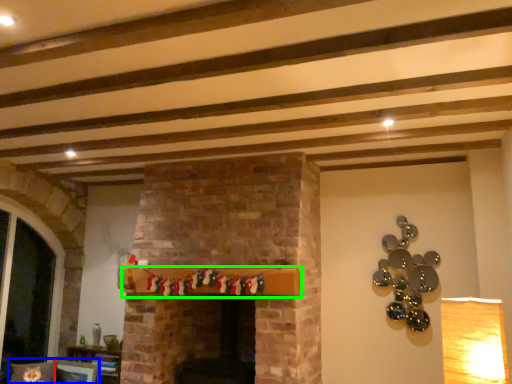
Question: Based on their relative distances, which object is nearer to picture frame (highlighted by a red box)? Choose from chair (highlighted by a blue box) and shelf (highlighted by a green box).

Choices:
 (A) chair
 (B) shelf

Answer: (A)